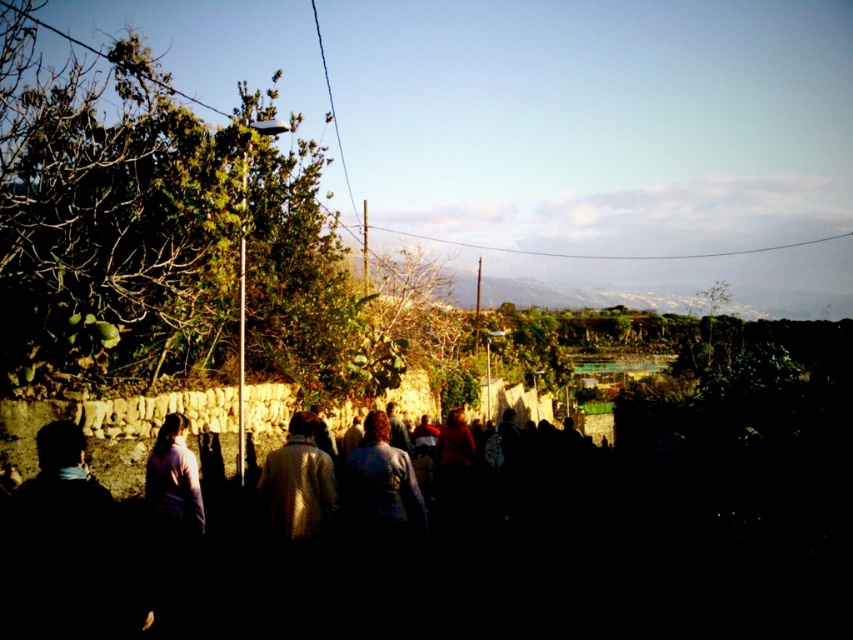
Does shiny metallic jacket at center appear on the left side of light purple sweater at center?

In fact, shiny metallic jacket at center is to the right of light purple sweater at center.

Can you confirm if shiny metallic jacket at center is taller than light purple sweater at center?

No, shiny metallic jacket at center is not taller than light purple sweater at center.

Is point (296, 477) more distant than point (148, 508)?

No.

Identify the location of shiny metallic jacket at center. (299, 483).

Can you confirm if shiny metallic jacket at center is taller than blue fabric jacket at center?

Indeed, shiny metallic jacket at center has a greater height compared to blue fabric jacket at center.

Is shiny metallic jacket at center to the right of blue fabric jacket at center from the viewer's perspective?

No, shiny metallic jacket at center is not to the right of blue fabric jacket at center.

You are a GUI agent. You are given a task and a screenshot of the screen. Output one action in this format:
    pyautogui.click(x=<x>, y=<y>)
    Task: Click on the shiny metallic jacket at center
    The image size is (853, 640).
    Given the screenshot: What is the action you would take?
    pyautogui.click(x=299, y=483)

Can you confirm if blue fabric jacket at center is positioned to the left of light purple sweater at center?

No, blue fabric jacket at center is not to the left of light purple sweater at center.

Does blue fabric jacket at center have a lesser width compared to light purple sweater at center?

Incorrect, blue fabric jacket at center's width is not less than light purple sweater at center's.

Is point (392, 525) positioned before point (196, 525)?

Yes, point (392, 525) is closer to viewer.

The width and height of the screenshot is (853, 640). What are the coordinates of `blue fabric jacket at center` in the screenshot? It's located at (380, 481).